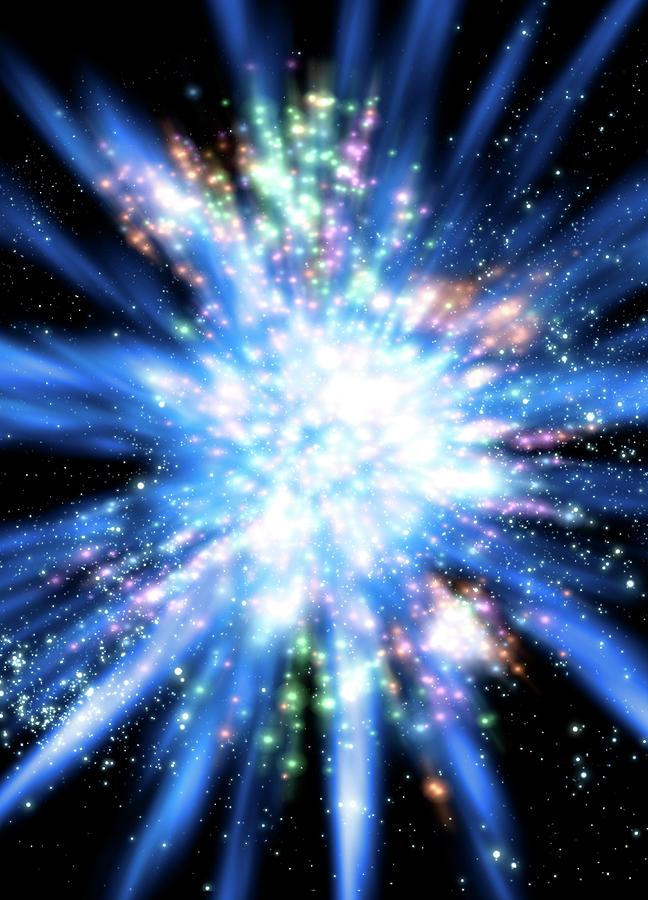
At what (x,y) coordinates should I click in order to perform the action: click on green light. Please return your answer as a coordinate pair (x, y). This screenshot has height=900, width=648. Looking at the image, I should click on (328, 703).